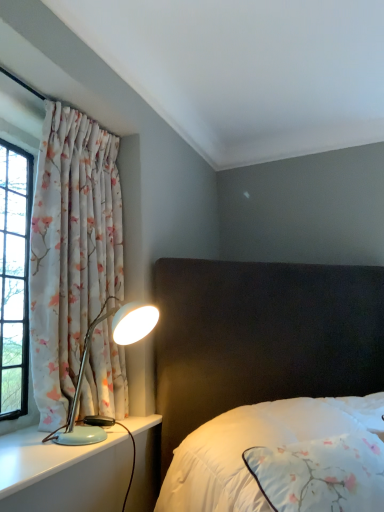
Question: Can you confirm if light blue plastic lamp at left is bigger than light blue plastic lamp at left?

Choices:
 (A) no
 (B) yes

Answer: (B)

Question: From the image's perspective, would you say light blue plastic lamp at left is positioned over light blue plastic lamp at left?

Choices:
 (A) no
 (B) yes

Answer: (B)

Question: Can you confirm if light blue plastic lamp at left is positioned to the right of light blue plastic lamp at left?

Choices:
 (A) yes
 (B) no

Answer: (A)

Question: Is light blue plastic lamp at left far away from light blue plastic lamp at left?

Choices:
 (A) no
 (B) yes

Answer: (A)

Question: From a real-world perspective, is light blue plastic lamp at left on top of light blue plastic lamp at left?

Choices:
 (A) yes
 (B) no

Answer: (A)

Question: Is the position of light blue plastic lamp at left less distant than that of light blue plastic lamp at left?

Choices:
 (A) yes
 (B) no

Answer: (B)

Question: Does white satin bed at center have a lesser height compared to light blue plastic lamp at left?

Choices:
 (A) no
 (B) yes

Answer: (A)

Question: Is white satin bed at center positioned behind light blue plastic lamp at left?

Choices:
 (A) no
 (B) yes

Answer: (A)

Question: Can you confirm if white satin bed at center is smaller than light blue plastic lamp at left?

Choices:
 (A) no
 (B) yes

Answer: (A)

Question: Can you confirm if white satin bed at center is wider than light blue plastic lamp at left?

Choices:
 (A) yes
 (B) no

Answer: (A)

Question: From the image's perspective, would you say white satin bed at center is positioned over light blue plastic lamp at left?

Choices:
 (A) yes
 (B) no

Answer: (A)

Question: Considering the relative sizes of white satin bed at center and light blue plastic lamp at left in the image provided, is white satin bed at center taller than light blue plastic lamp at left?

Choices:
 (A) no
 (B) yes

Answer: (B)

Question: From the image's perspective, does light blue plastic lamp at left appear higher than floral fabric curtain at left?

Choices:
 (A) no
 (B) yes

Answer: (A)